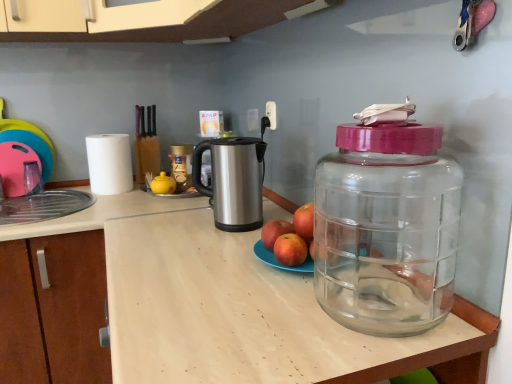
Question: Should I look upward or downward to see metallic gold jar at center, the second bottle positioned from the right?

Choices:
 (A) up
 (B) down

Answer: (A)

Question: Is red matte apple at center, the 3th apple viewed from the right, at the back of transparent wood counter top at center, positioned as the second counter top in back-to-front order?

Choices:
 (A) yes
 (B) no

Answer: (B)

Question: From a real-world perspective, is transparent wood counter top at center, the 1th counter top positioned from the front, located higher than red matte apple at center, the 3th apple viewed from the right?

Choices:
 (A) no
 (B) yes

Answer: (A)

Question: From the image's perspective, is transparent wood counter top at center, the 1th counter top positioned from the front, under red matte apple at center, the 3th apple viewed from the right?

Choices:
 (A) no
 (B) yes

Answer: (B)

Question: Is the depth of transparent wood counter top at center, positioned as the second counter top in back-to-front order, less than that of red matte apple at center, the 3th apple viewed from the right?

Choices:
 (A) yes
 (B) no

Answer: (A)

Question: Can you confirm if transparent wood counter top at center, the 1th counter top positioned from the front, is positioned to the right of red matte apple at center, the 3th apple viewed from the right?

Choices:
 (A) yes
 (B) no

Answer: (B)

Question: Is pink rubber toy at left taller than transparent plastic bottle at right, which ranks as the 2th bottle in left-to-right order?

Choices:
 (A) yes
 (B) no

Answer: (A)

Question: Is pink rubber toy at left shorter than transparent plastic bottle at right, which ranks as the 2th bottle in left-to-right order?

Choices:
 (A) no
 (B) yes

Answer: (A)

Question: Considering the relative sizes of pink rubber toy at left and transparent plastic bottle at right, which is the first bottle in right-to-left order, in the image provided, is pink rubber toy at left wider than transparent plastic bottle at right, which is the first bottle in right-to-left order,?

Choices:
 (A) no
 (B) yes

Answer: (A)

Question: Is pink rubber toy at left thinner than transparent plastic bottle at right, arranged as the 1th bottle when viewed from the front?

Choices:
 (A) no
 (B) yes

Answer: (B)

Question: Does pink rubber toy at left lie behind transparent plastic bottle at right, arranged as the 1th bottle when viewed from the front?

Choices:
 (A) yes
 (B) no

Answer: (A)

Question: From a real-world perspective, does pink rubber toy at left sit lower than transparent plastic bottle at right, the second bottle viewed from the back?

Choices:
 (A) no
 (B) yes

Answer: (A)

Question: From the image's perspective, is transparent plastic bottle at right, which is the first bottle in right-to-left order, on top of white matte paper towel at left?

Choices:
 (A) yes
 (B) no

Answer: (B)